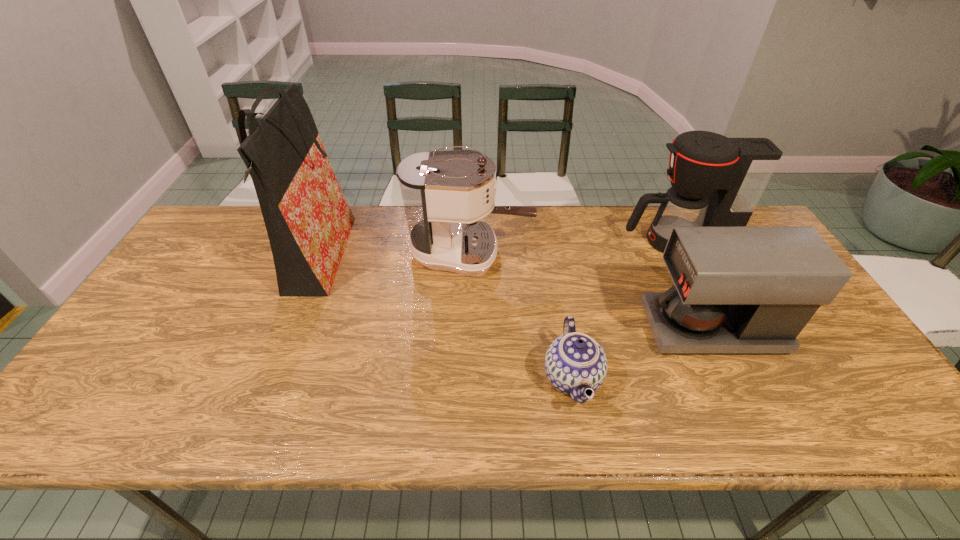
This screenshot has width=960, height=540. I want to click on object that is the fourth closest to the second shortest object, so click(308, 221).

This screenshot has height=540, width=960. Find the location of `coffee maker that is the third nearest to the shopping bag`. coffee maker that is the third nearest to the shopping bag is located at coordinates (716, 181).

In order to click on coffee maker that can be found as the third closest to the shortest object in this screenshot , I will do `click(716, 181)`.